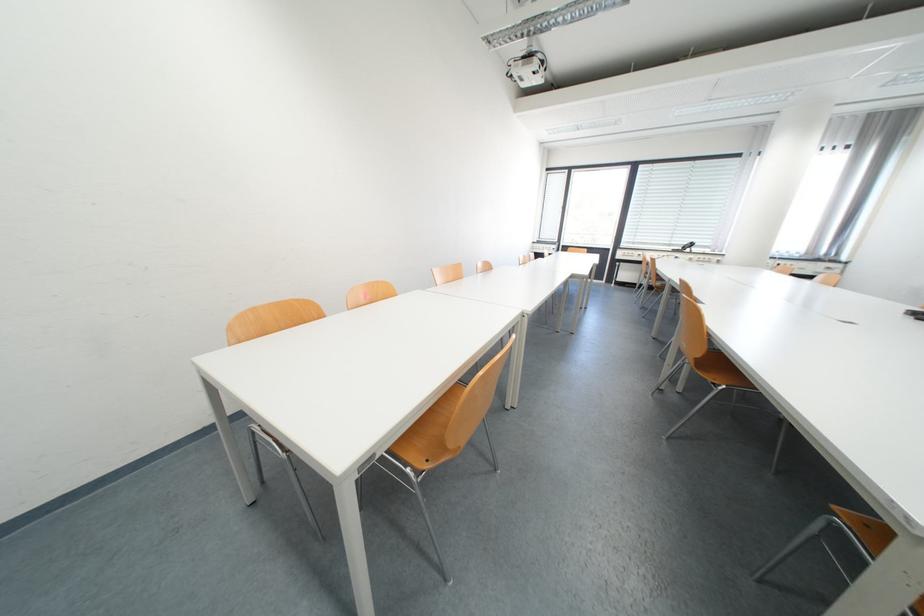
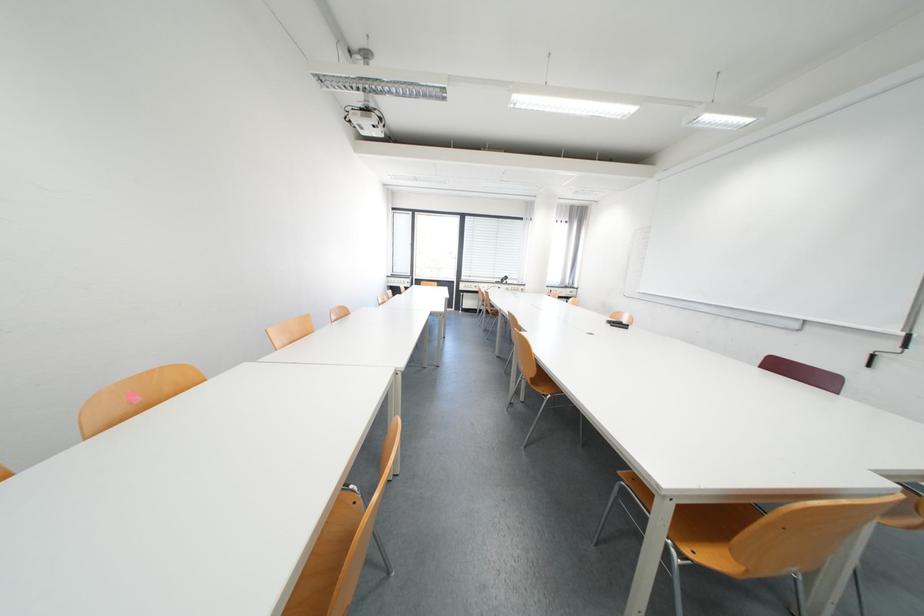
The point at (707, 361) is marked in the first image. Where is the corresponding point in the second image?

(541, 379)